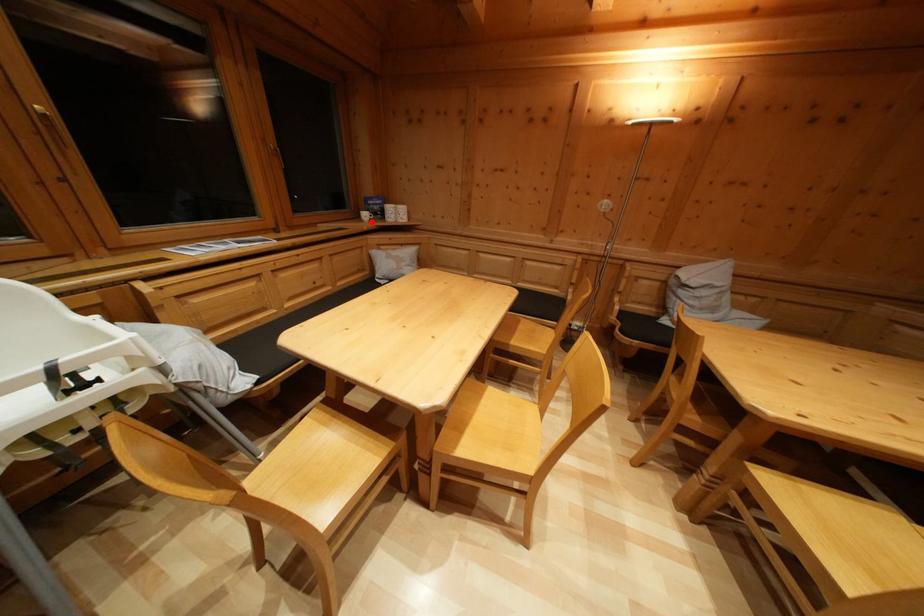
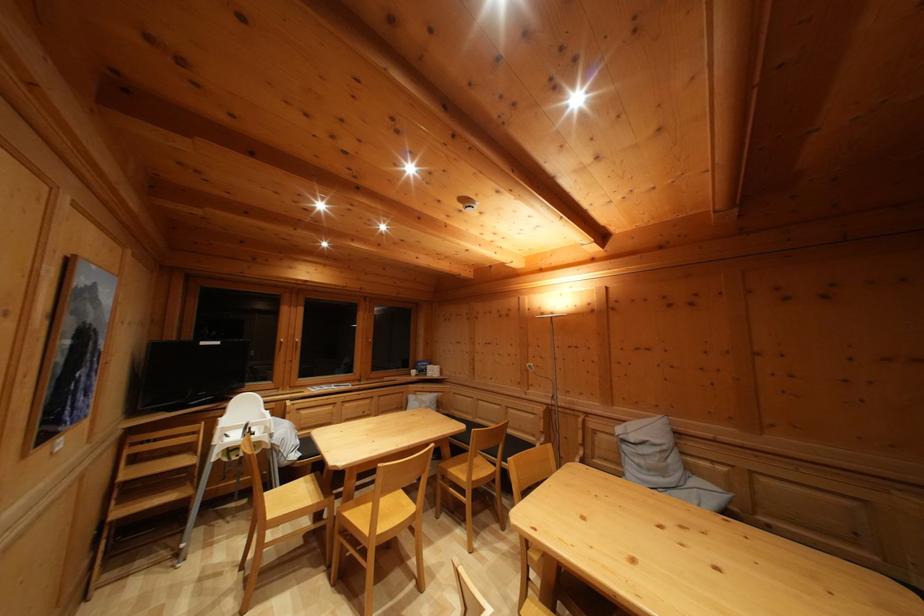
Question: I am providing you with two images of the same scene from different viewpoints. Image1 has a red point marked. In image2, the corresponding 3D location appears at what relative position? Reply with the corresponding letter.

Choices:
 (A) Closer
 (B) Farther

Answer: (B)